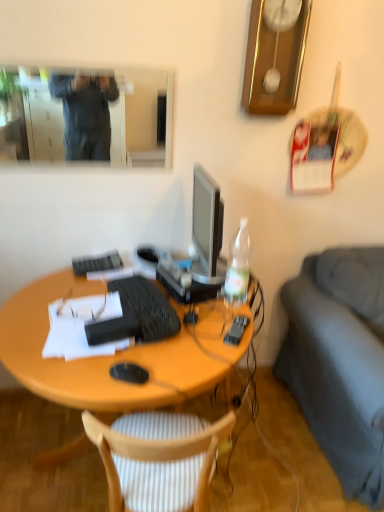
Question: From a real-world perspective, is black matte computer mouse at center positioned above or below black plastic remote control at right?

Choices:
 (A) above
 (B) below

Answer: (A)

Question: Considering the relative positions of black matte computer mouse at center and black plastic remote control at right in the image provided, is black matte computer mouse at center to the left or to the right of black plastic remote control at right?

Choices:
 (A) right
 (B) left

Answer: (B)

Question: Which object is the farthest from the wooden desk at center?

Choices:
 (A) matte black glasses at center
 (B) wooden striped cushion at center
 (C) white paper at center
 (D) wooden clock at upper center
 (E) black matte computer mouse at center

Answer: (D)

Question: Which object is the farthest from the matte black glasses at center?

Choices:
 (A) black matte keyboard at center, which appears as the second computer keyboard when viewed from the top
 (B) clear plastic bottle at right
 (C) wooden striped cushion at center
 (D) wooden desk at center
 (E) matte black mirror at upper left

Answer: (E)